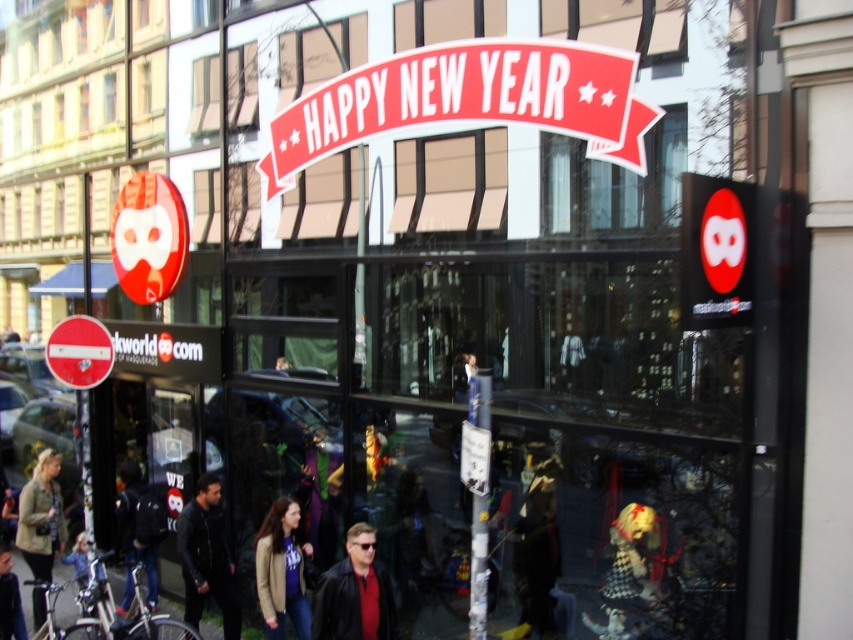
You are a customer standing in front of the store and want to take a photo of the red glossy banner at upper center and the khaki fabric jacket at lower left. Which object should you point your camera towards first if you want to capture both in a single frame without moving the camera?

You should point your camera towards the khaki fabric jacket at lower left first because the red glossy banner at upper center is to the right of it, so capturing the jacket first allows the banner to be included on the right side of the frame.

You are a delivery person who needs to place a 10 feet long ladder against the storefront. The ladder must be placed between the red glossy banner at upper center and the matte black jacket at center. Is the space between them sufficient for the ladder?

The distance between the red glossy banner at upper center and the matte black jacket at center is 9.25 feet, which is shorter than the 10 feet ladder. Therefore, the space is insufficient for the ladder.

You are a window cleaner needing to clean the red glossy banner at upper center and the khaki fabric jacket at lower left. Since you have a ladder that can reach up to 2 meters, can you clean both objects without moving the ladder?

The red glossy banner at upper center is located at upper center and the khaki fabric jacket at lower left is at lower left. Since the ladder can reach up to 2 meters, you can clean both objects without moving the ladder as long as their heights are within the ladder reach. However, the description only provides information about their widths, not heights, so you need to check the actual heights of the objects to confirm.